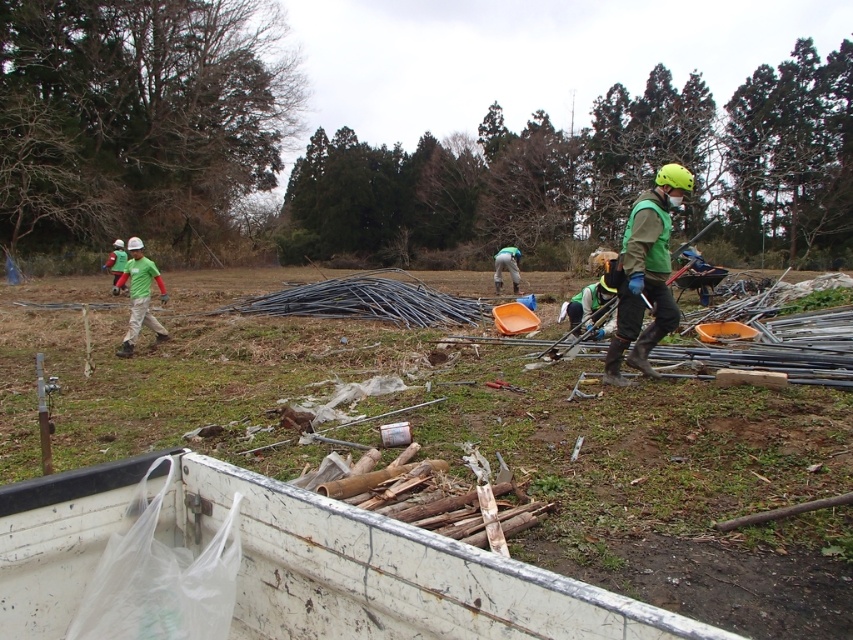
You are a worker standing at the origin point in the field. You need to place a new item at the coordinates given in the description. Where should you place the item relative to the smooth metal rods at center?

The smooth metal rods at center are located at point (466,438), so you should place the new item at those coordinates relative to the smooth metal rods at center.

You are a supervisor observing the workers in the scene. Which worker is closer to you, the green fabric worker at center or the green matte shirt at left?

The green fabric worker at center is closer to you because they are positioned in front of the green matte shirt at left.